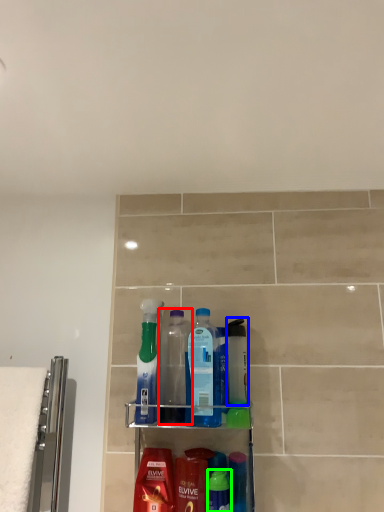
Question: Considering the real-world distances, which object is farthest from bottle (highlighted by a red box)? mouthwash (highlighted by a blue box) or mouthwash (highlighted by a green box)?

Choices:
 (A) mouthwash
 (B) mouthwash

Answer: (B)